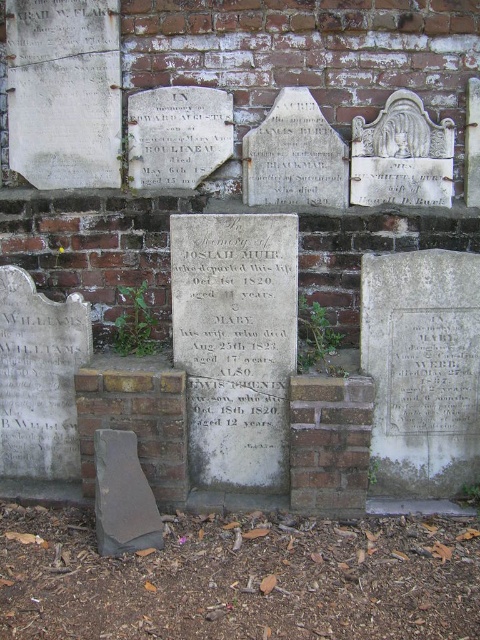
Question: Which point is farther to the camera?

Choices:
 (A) white stone plaque at center
 (B) gray stone gravestone at lower left
 (C) gray stone plaque at center

Answer: (A)

Question: Estimate the real-world distances between objects in this image. Which object is closer to the white stone plaque at center?

Choices:
 (A) gray stone plaque at center
 (B) gray stone gravestone at lower left

Answer: (A)

Question: Can you confirm if white stone plaque at center is positioned below gray stone gravestone at lower left?

Choices:
 (A) yes
 (B) no

Answer: (B)

Question: Can you confirm if gray stone plaque at center is wider than white stone plaque at center?

Choices:
 (A) no
 (B) yes

Answer: (B)

Question: Can you confirm if white stone plaque at center is smaller than gray stone gravestone at lower left?

Choices:
 (A) no
 (B) yes

Answer: (A)

Question: Which object appears closest to the camera in this image?

Choices:
 (A) gray stone plaque at center
 (B) gray stone gravestone at lower left
 (C) white stone plaque at center

Answer: (B)